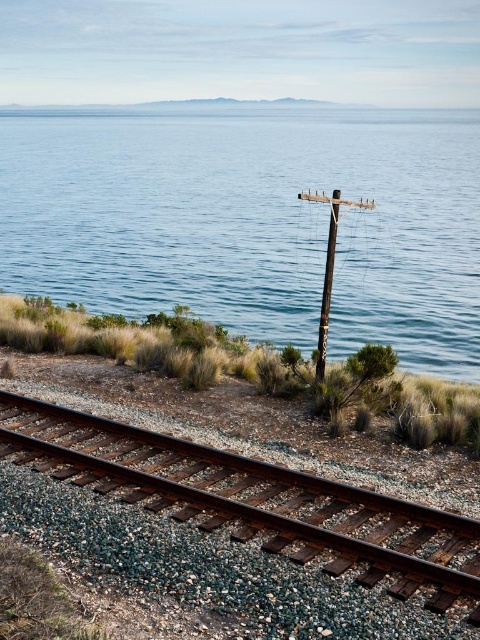
This screenshot has width=480, height=640. What do you see at coordinates (253, 221) in the screenshot? I see `blue water at center` at bounding box center [253, 221].

Is blue water at center bigger than brown wooden telegraph pole at center?

Yes, blue water at center is bigger than brown wooden telegraph pole at center.

Image resolution: width=480 pixels, height=640 pixels. What are the coordinates of `blue water at center` in the screenshot? It's located at (253, 221).

Does rusty metal track at lower center appear under brown wooden telegraph pole at center?

Correct, rusty metal track at lower center is located below brown wooden telegraph pole at center.

Describe the element at coordinates (253, 499) in the screenshot. I see `rusty metal track at lower center` at that location.

Is point (172, 481) closer to camera compared to point (330, 218)?

Yes, point (172, 481) is closer to viewer.

The height and width of the screenshot is (640, 480). In order to click on rusty metal track at lower center in this screenshot , I will do `click(253, 499)`.

Is the position of brown wooden telegraph pole at center less distant than that of wooden pole at center?

Yes, it is in front of wooden pole at center.

Is point (320, 320) in front of point (327, 310)?

No.

Which is behind, point (330, 214) or point (320, 339)?

Positioned behind is point (330, 214).

You are a GUI agent. You are given a task and a screenshot of the screen. Output one action in this format:
    pyautogui.click(x=<x>, y=<y>)
    Task: Click on the brown wooden telegraph pole at center
    This screenshot has height=640, width=480.
    Given the screenshot: What is the action you would take?
    pyautogui.click(x=328, y=266)